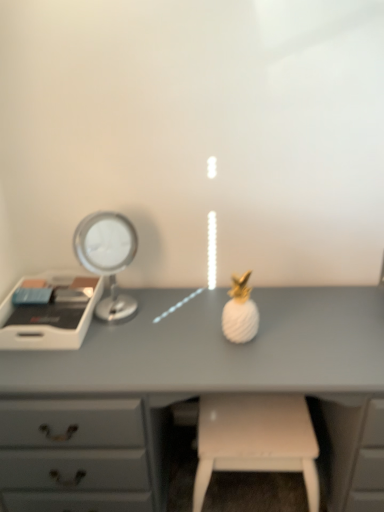
The height and width of the screenshot is (512, 384). I want to click on unoccupied area in front of silver metallic mirror at left, so click(x=112, y=349).